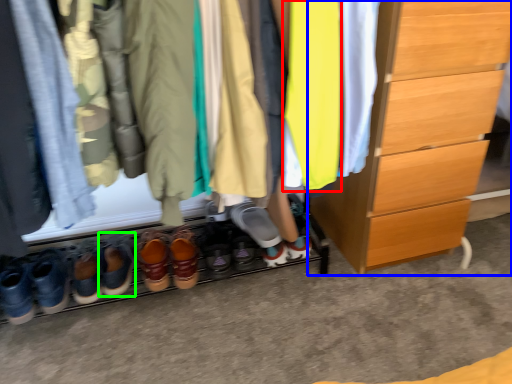
Question: Which object is the closest to the clothing (highlighted by a red box)? Choose among these: chest of drawers (highlighted by a blue box) or footwear (highlighted by a green box).

Choices:
 (A) chest of drawers
 (B) footwear

Answer: (A)